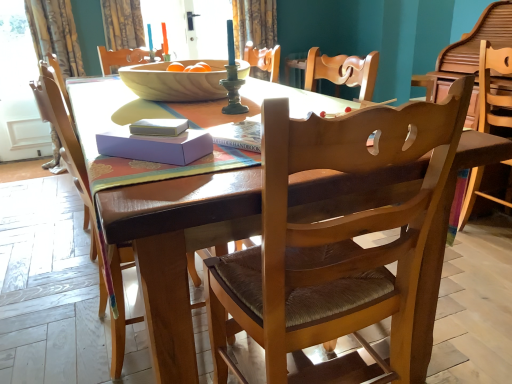
You are a GUI agent. You are given a task and a screenshot of the screen. Output one action in this format:
    pyautogui.click(x=<x>, y=<y>)
    Task: Click on the blank space situated above lavender cardboard box at center (from a real-world perspective)
    
    Given the screenshot: What is the action you would take?
    [x=157, y=124]